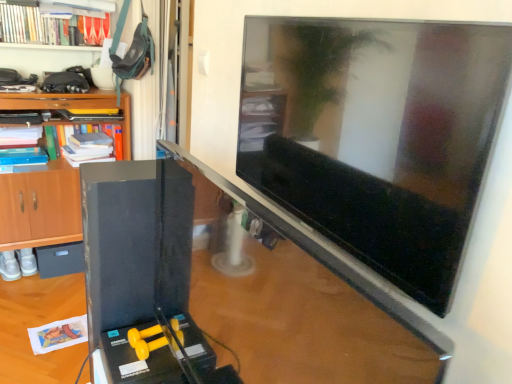
Where is `vacant area that is in front of black matte drawer at lower left`? The height and width of the screenshot is (384, 512). vacant area that is in front of black matte drawer at lower left is located at coordinates (44, 291).